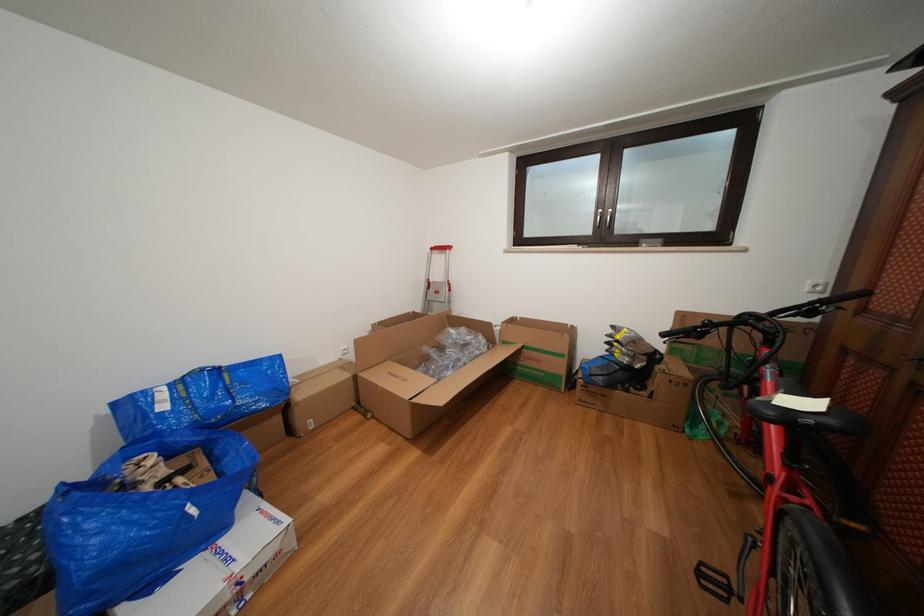
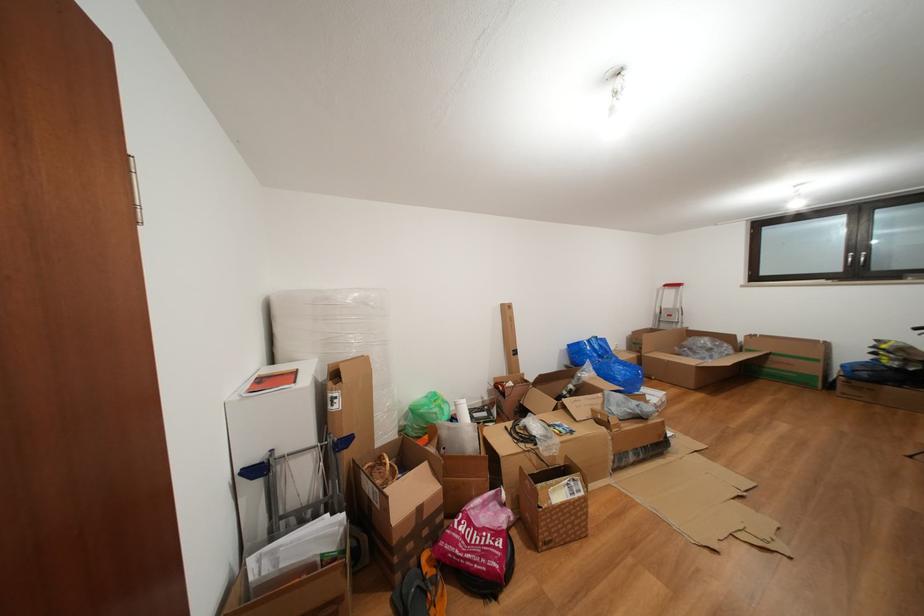
Locate, in the second image, the point that corresponds to point (441, 254) in the first image.

(674, 291)